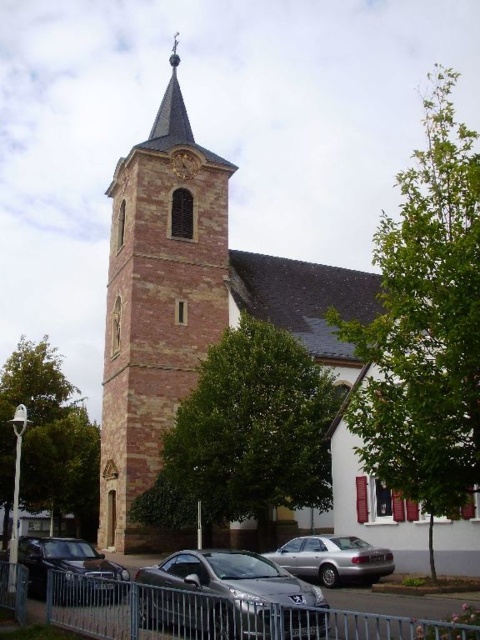
Does red brick church at center appear under metallic silver fence at lower center?

No.

Between point (115, 404) and point (94, 609), which one is positioned behind?

The point (115, 404) is more distant.

Where is `red brick church at center`? This screenshot has width=480, height=640. red brick church at center is located at coordinates (190, 307).

Can you confirm if metallic silver fence at lower center is shorter than metallic clock at upper center?

In fact, metallic silver fence at lower center may be taller than metallic clock at upper center.

Who is more distant from viewer, [466,632] or [191,150]?

The point [191,150] is behind.

At what (x,y) coordinates should I click in order to perform the action: click on metallic silver fence at lower center. Please return your answer as a coordinate pair (x, y). The width and height of the screenshot is (480, 640). Looking at the image, I should click on (216, 616).

Who is positioned more to the right, reddish-brown stone tower at center-left or metallic silver fence at lower center?

Positioned to the right is metallic silver fence at lower center.

Which is in front, point (173, 253) or point (132, 595)?

Positioned in front is point (132, 595).

I want to click on reddish-brown stone tower at center-left, so click(x=156, y=305).